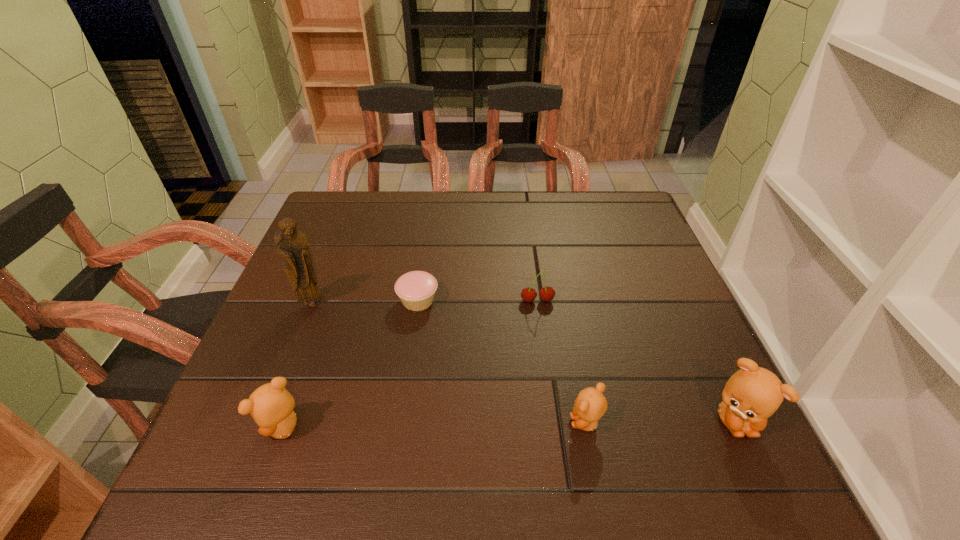
I want to click on vacant area that lies between the rightmost object and the leftmost teddy bear, so click(509, 424).

The width and height of the screenshot is (960, 540). In order to click on vacant area that lies between the shortest teddy bear and the cupcake in this screenshot , I will do `click(502, 361)`.

Locate an element on the screen. The image size is (960, 540). empty space between the shortest object and the fourth shortest object is located at coordinates (351, 364).

I want to click on empty space between the cherry and the rightmost object, so click(x=636, y=360).

Where is `free space between the shortest teddy bear and the tallest object`? free space between the shortest teddy bear and the tallest object is located at coordinates (449, 363).

Identify which object is the second closest to the tallest object. Please provide its 2D coordinates. Your answer should be formatted as a tuple, i.e. [(x, y)], where the tuple contains the x and y coordinates of a point satisfying the conditions above.

[(271, 406)]

At what (x,y) coordinates should I click in order to perform the action: click on object that ranks as the closest to the cherry. Please return your answer as a coordinate pair (x, y). Looking at the image, I should click on (416, 289).

At what (x,y) coordinates should I click in order to perform the action: click on the closest teddy bear to the shortest teddy bear. Please return your answer as a coordinate pair (x, y). The image size is (960, 540). Looking at the image, I should click on (752, 394).

Point out which teddy bear is positioned as the third nearest to the cherry. Please provide its 2D coordinates. Your answer should be formatted as a tuple, i.e. [(x, y)], where the tuple contains the x and y coordinates of a point satisfying the conditions above.

[(271, 406)]

Find the location of a particular element. This screenshot has width=960, height=540. vacant area that satisfies the following two spatial constraints: 1. on the face of the second tallest object; 2. on the face of the second shortest teddy bear is located at coordinates (737, 428).